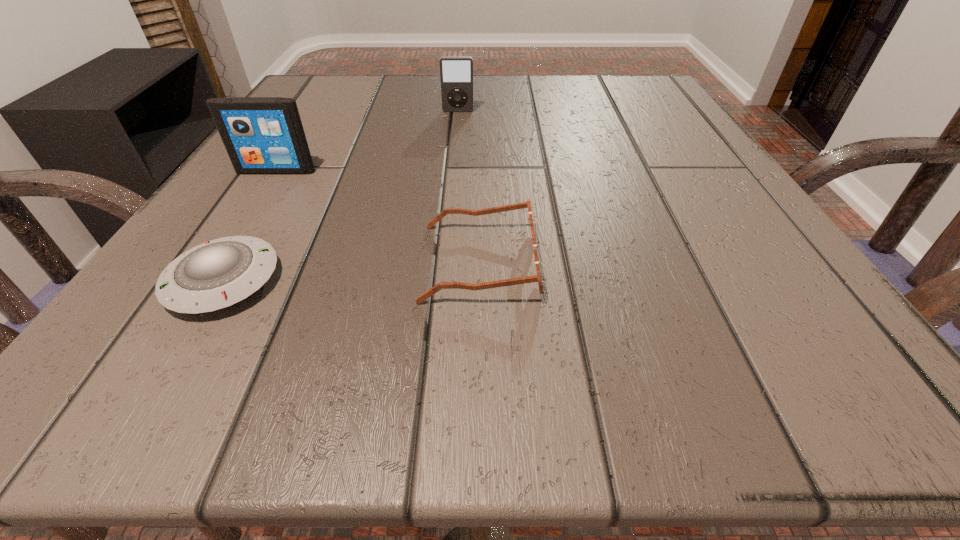
Where is `object that can be found as the third closest to the spectacles`? object that can be found as the third closest to the spectacles is located at coordinates (456, 73).

Where is `the third closest object to the third tallest object`? This screenshot has height=540, width=960. the third closest object to the third tallest object is located at coordinates [456, 73].

Where is `free space that satisfies the following two spatial constraints: 1. on the front screen of the nearer iPod; 2. on the right side of the shortest object`? The height and width of the screenshot is (540, 960). free space that satisfies the following two spatial constraints: 1. on the front screen of the nearer iPod; 2. on the right side of the shortest object is located at coordinates point(206,281).